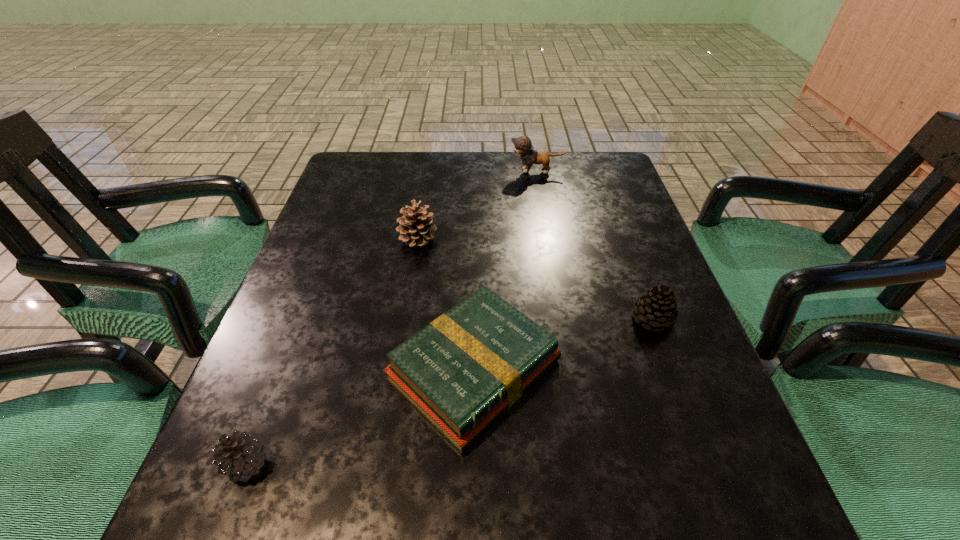
Identify the location of kitten. The height and width of the screenshot is (540, 960). (522, 145).

Image resolution: width=960 pixels, height=540 pixels. In order to click on the second pinecone from left to right in this screenshot , I will do `click(414, 229)`.

Locate an element on the screen. This screenshot has width=960, height=540. the fourth nearest object is located at coordinates (414, 229).

Where is `the rightmost object`? the rightmost object is located at coordinates (656, 308).

Find the location of a particular element. Image resolution: width=960 pixels, height=540 pixels. the second farthest pinecone is located at coordinates (656, 308).

You are a GUI agent. You are given a task and a screenshot of the screen. Output one action in this format:
    pyautogui.click(x=<x>, y=<y>)
    Task: Click on the nearest pinecone
    The width and height of the screenshot is (960, 540).
    Given the screenshot: What is the action you would take?
    pyautogui.click(x=242, y=456)

At what (x,y) coordinates should I click in order to perform the action: click on the leftmost object. Please return your answer as a coordinate pair (x, y). Image resolution: width=960 pixels, height=540 pixels. Looking at the image, I should click on (242, 456).

Where is `the shortest object`? This screenshot has width=960, height=540. the shortest object is located at coordinates (461, 372).

The height and width of the screenshot is (540, 960). Find the location of `free region located 0.350m on the front-facing side of the farthest object`. free region located 0.350m on the front-facing side of the farthest object is located at coordinates (387, 171).

This screenshot has height=540, width=960. In order to click on free space located on the front-facing side of the farthest object in this screenshot , I will do `click(411, 171)`.